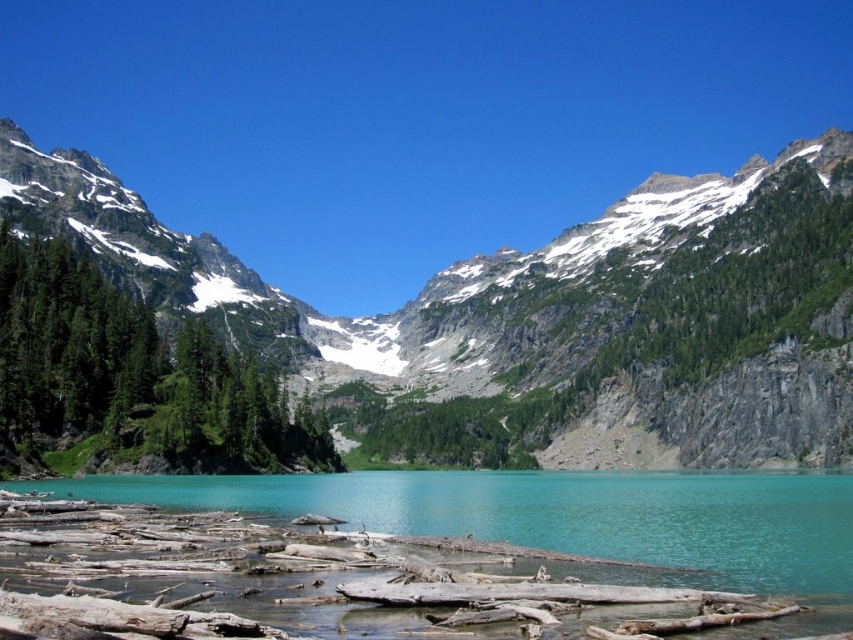
You are a hiker standing on the mountain path. You see the turquoise glassy water at center and the green matte tree at left. Which object is closer to you?

The green matte tree at left is closer to you because it is positioned above the turquoise glassy water at center, indicating it is nearer in the scene.

You are standing at the edge of the lake and want to walk towards the two points marked in the image. Which point, point (288, 484) or point (227, 396), will you reach first?

Point (288, 484) is further to the viewer than point (227, 396), so you will reach point (288, 484) first.